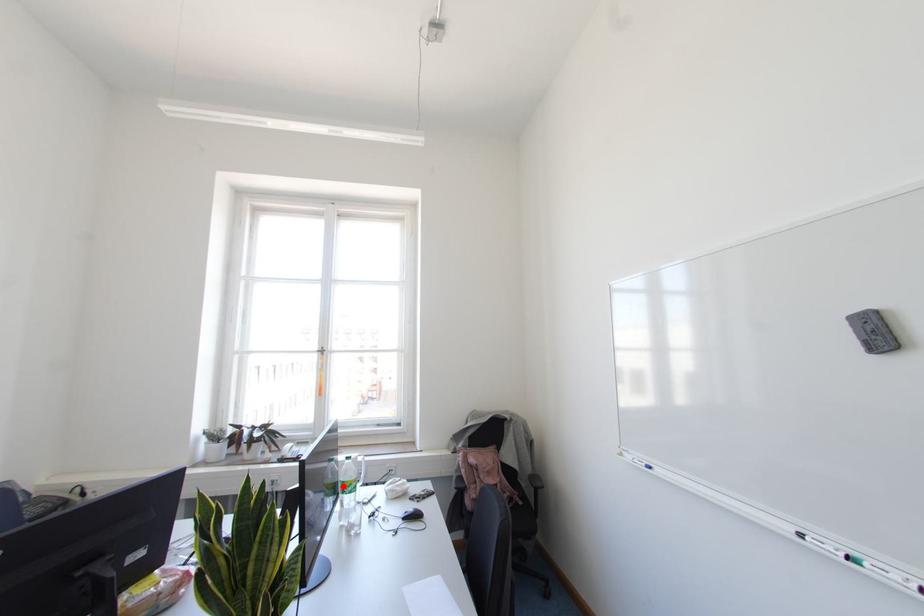
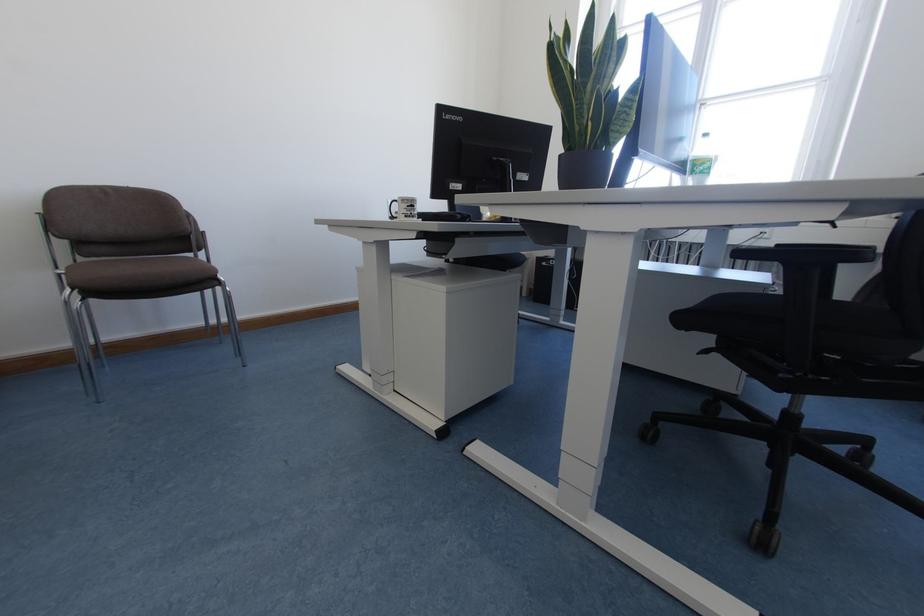
Question: A red point is marked in image1. In image2, is the corresponding 3D point closer to the camera or farther? Reply with the corresponding letter.

Choices:
 (A) The corresponding 3D point is closer.
 (B) The corresponding 3D point is farther.

Answer: (B)